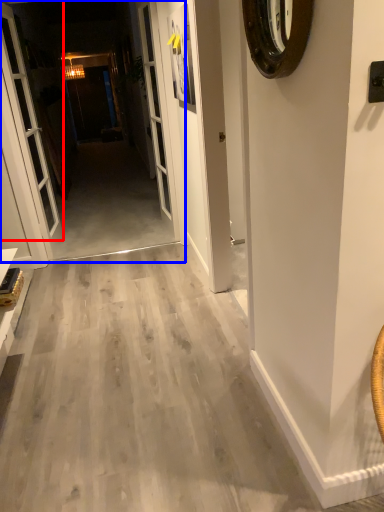
Question: Which of the following is the closest to the observer, door (highlighted by a red box) or corridor (highlighted by a blue box)?

Choices:
 (A) door
 (B) corridor

Answer: (A)